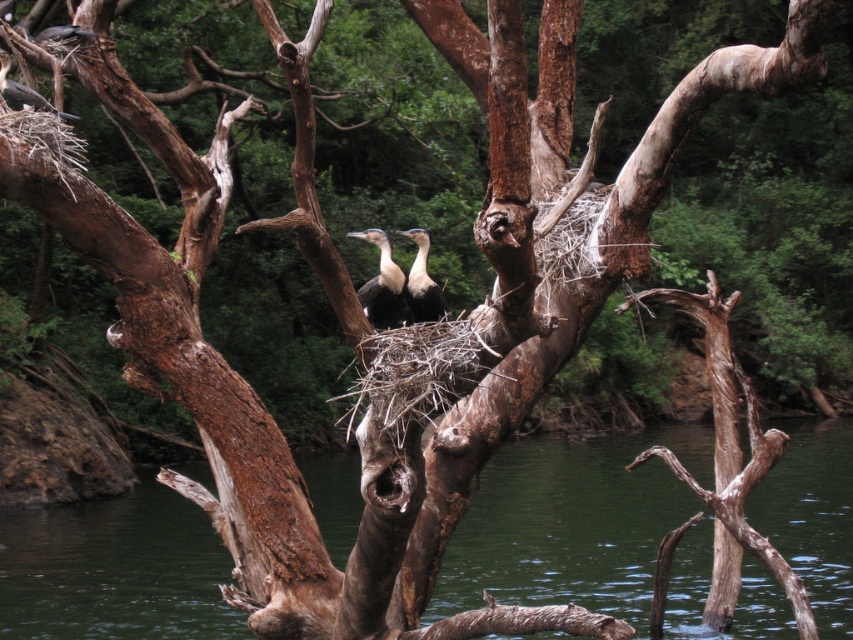
Question: Which point is closer to the camera taking this photo?

Choices:
 (A) (61, 115)
 (B) (469, 586)
 (C) (434, 289)

Answer: (C)

Question: Which object is positioned farthest from the white glossy birds at center?

Choices:
 (A) white glossy bird at center
 (B) matte black bird at upper left
 (C) green liquid water at lower center

Answer: (C)

Question: Can you confirm if green liquid water at lower center is bigger than white glossy birds at center?

Choices:
 (A) no
 (B) yes

Answer: (B)

Question: Is green liquid water at lower center wider than matte black bird at upper left?

Choices:
 (A) yes
 (B) no

Answer: (A)

Question: In this image, where is white glossy bird at center located relative to white glossy birds at center?

Choices:
 (A) left
 (B) right

Answer: (A)

Question: Which point is closer to the camera taking this photo?

Choices:
 (A) click(636, 492)
 (B) click(393, 275)

Answer: (B)